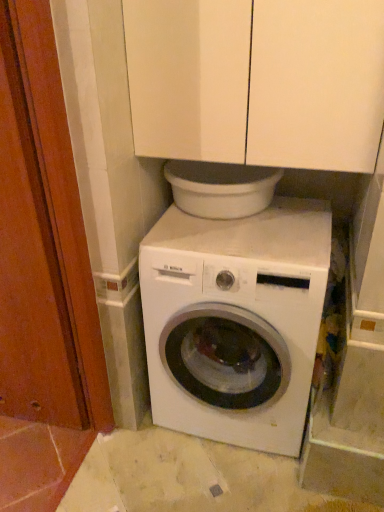
At what (x,y) coordinates should I click in order to perform the action: click on empty space that is ontop of concrete tile floor at center (from a real-world perspective). Please return your answer as a coordinate pair (x, y). Looking at the image, I should click on (196, 466).